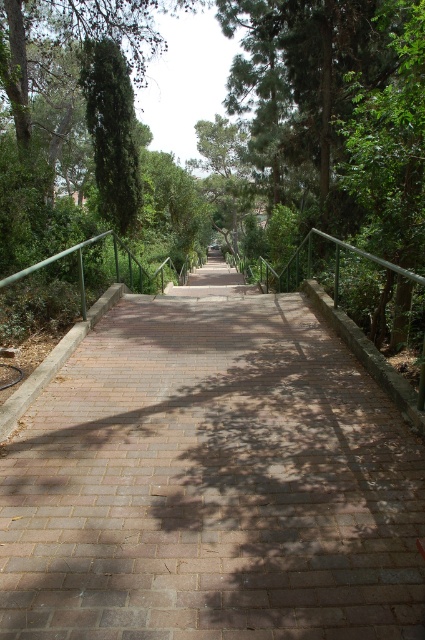
You are a gardener planning to place a large decorative statue that requires a 3x3 meter space. Based on the scene, can you determine if the brick paved path at center has enough space to accommodate the statue without encroaching on the green leafy tree at upper left?

The brick paved path at center is larger in size than the green leafy tree at upper left, so it likely has sufficient space to place the statue without affecting the tree.

You are a gardener planning to trim the green leafy tree at upper left. To avoid damaging the brick paved path at center, which direction should you ensure the tree branches are trimmed away from?

The brick paved path at center is positioned on the right side of the green leafy tree at upper left. Therefore, the gardener should trim the branches away from the right side to avoid damaging the brick paved path at center.